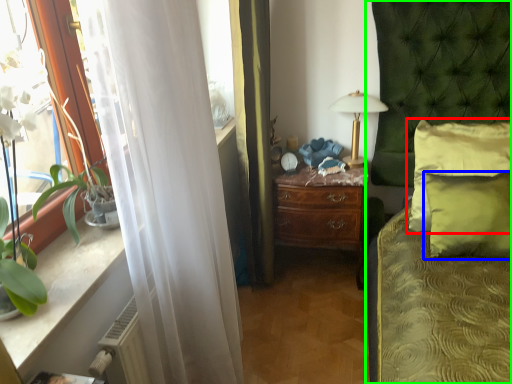
Question: Which object is the closest to the pillow (highlighted by a red box)? Choose among these: pillow (highlighted by a blue box) or bed (highlighted by a green box).

Choices:
 (A) pillow
 (B) bed

Answer: (A)